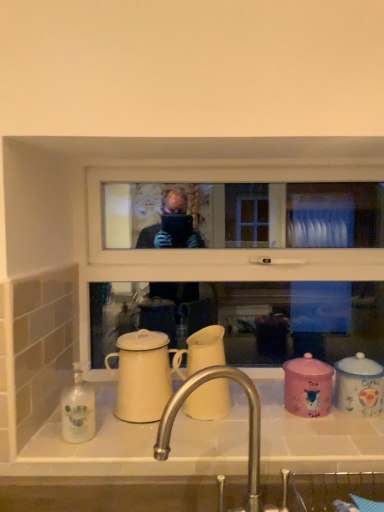
Question: Considering the relative positions of blue glossy coffee cup at right, which is counted as the 1th coffee cup, starting from the right, and white glossy sink at lower center in the image provided, is blue glossy coffee cup at right, which is counted as the 1th coffee cup, starting from the right, to the left of white glossy sink at lower center from the viewer's perspective?

Choices:
 (A) yes
 (B) no

Answer: (B)

Question: From a real-world perspective, is blue glossy coffee cup at right, which is counted as the 1th coffee cup, starting from the right, on white glossy sink at lower center?

Choices:
 (A) yes
 (B) no

Answer: (A)

Question: From a real-world perspective, does blue glossy coffee cup at right, which is counted as the 1th coffee cup, starting from the right, sit lower than white glossy sink at lower center?

Choices:
 (A) yes
 (B) no

Answer: (B)

Question: Is blue glossy coffee cup at right, positioned as the 4th coffee cup in left-to-right order, at the right side of white glossy sink at lower center?

Choices:
 (A) yes
 (B) no

Answer: (A)

Question: Considering the relative positions of blue glossy coffee cup at right, which is counted as the 1th coffee cup, starting from the right, and white glossy sink at lower center in the image provided, is blue glossy coffee cup at right, which is counted as the 1th coffee cup, starting from the right, behind white glossy sink at lower center?

Choices:
 (A) no
 (B) yes

Answer: (B)

Question: From the image's perspective, relative to white glossy sink at lower center, is satin nickel faucet at center above or below?

Choices:
 (A) below
 (B) above

Answer: (B)

Question: Relative to white glossy sink at lower center, is satin nickel faucet at center in front or behind?

Choices:
 (A) behind
 (B) front

Answer: (B)

Question: Considering the positions of satin nickel faucet at center and white glossy sink at lower center in the image, is satin nickel faucet at center bigger or smaller than white glossy sink at lower center?

Choices:
 (A) small
 (B) big

Answer: (B)

Question: Based on their positions, is satin nickel faucet at center located to the left or right of white glossy sink at lower center?

Choices:
 (A) left
 (B) right

Answer: (A)

Question: Relative to matte white mug at center, the 1th coffee cup in the left-to-right sequence, is white glossy sink at lower center in front or behind?

Choices:
 (A) front
 (B) behind

Answer: (A)

Question: Would you say white glossy sink at lower center is inside or outside matte white mug at center, the 1th coffee cup in the left-to-right sequence?

Choices:
 (A) inside
 (B) outside

Answer: (B)

Question: Looking at their shapes, would you say white glossy sink at lower center is wider or thinner than matte white mug at center, the 1th coffee cup in the left-to-right sequence?

Choices:
 (A) thin
 (B) wide

Answer: (B)

Question: From their relative heights in the image, would you say white glossy sink at lower center is taller or shorter than matte white mug at center, the 1th coffee cup in the left-to-right sequence?

Choices:
 (A) tall
 (B) short

Answer: (B)

Question: From a real-world perspective, is white matte coffee cup at center, the second coffee cup in the left-to-right sequence, positioned above or below pink ceramic jar at lower right, the second coffee cup viewed from the right?

Choices:
 (A) below
 (B) above

Answer: (B)

Question: Considering the positions of point (208, 345) and point (311, 372), is point (208, 345) closer or farther from the camera than point (311, 372)?

Choices:
 (A) closer
 (B) farther

Answer: (B)